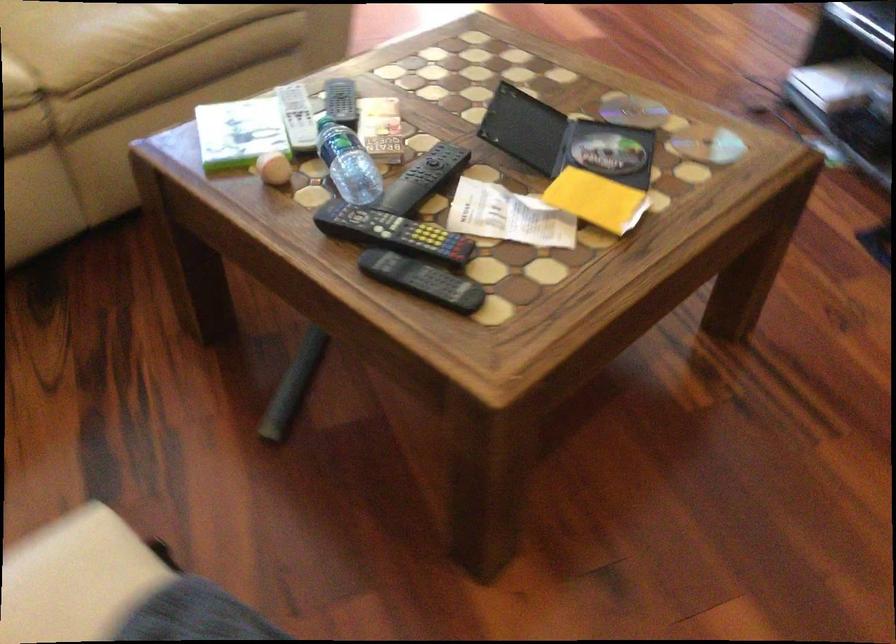
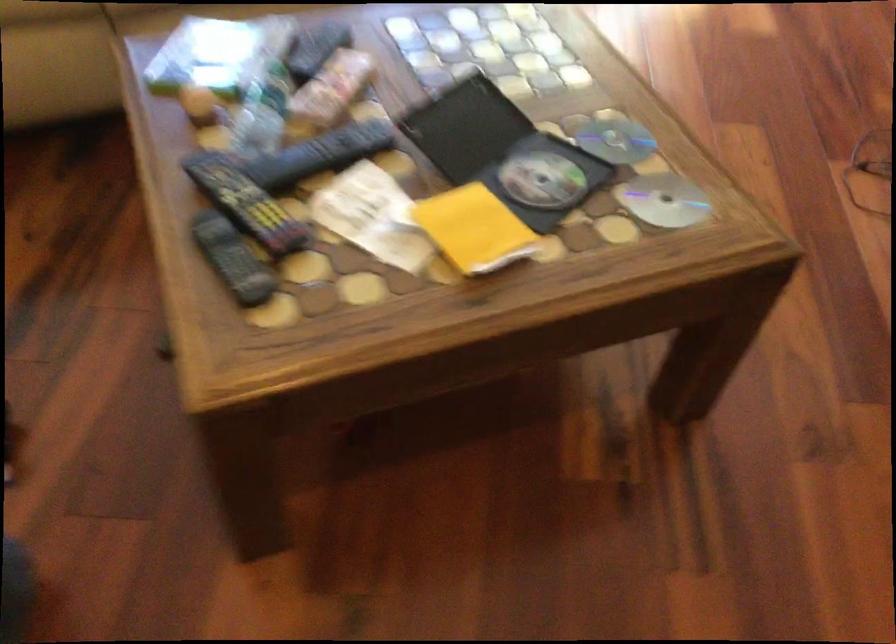
Locate, in the second image, the point that corresponds to point (556, 140) in the first image.

(503, 152)